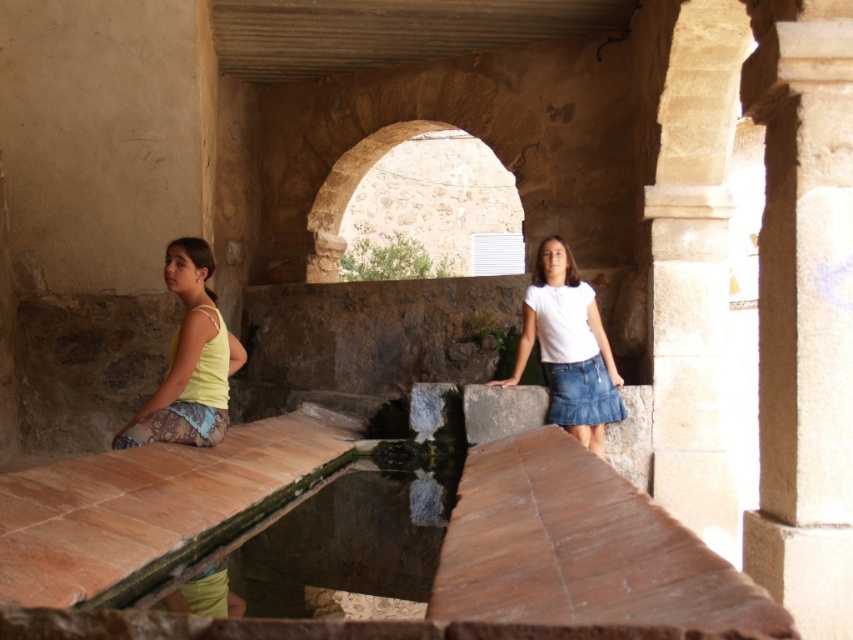
You are standing in the old stone structure and want to take a photo of the white stone pillar at right and the yellow fabric skirt at left. Which object should you focus on first if you want to capture both in the same frame without moving your camera?

You should focus on the white stone pillar at right first because it is closer to you than the yellow fabric skirt at left, allowing both to be in the same frame without moving the camera.

Looking at this image, you are an archaeologist examining the old stone structure. You notice a smooth stone pillar at right and a yellow fabric skirt at left. Which object is positioned higher in the scene?

The smooth stone pillar at right is located above the yellow fabric skirt at left, so it is positioned higher in the scene.

You are standing in the old stone structure and want to find the white stone pillar at right. According to the coordinates provided, where should you look relative to the image frame?

The white stone pillar at right is located at the coordinates point (804, 310), so you should look towards the lower right corner of the image frame.